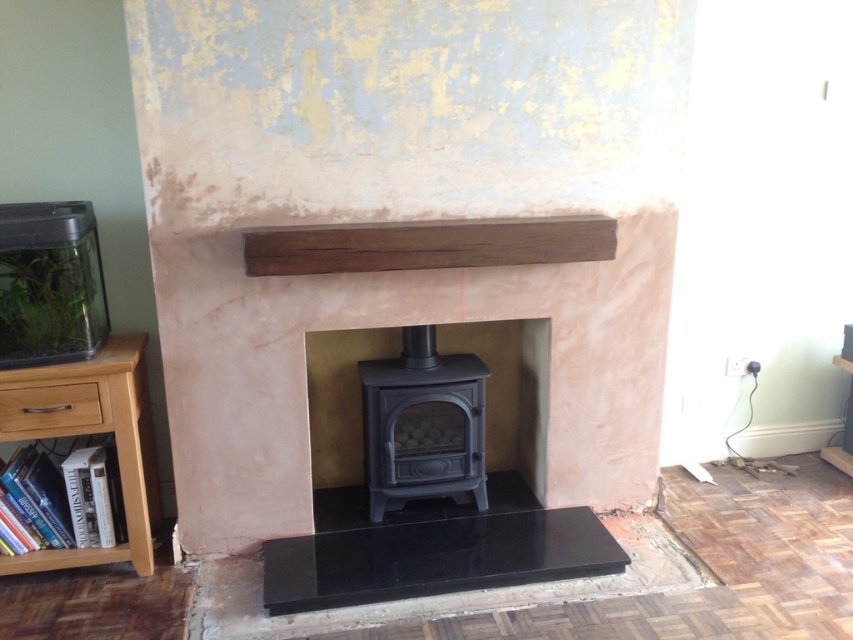
Measure the distance between matte black stove at center and light wood/bookshelf at lower left.

matte black stove at center is 35.94 inches from light wood/bookshelf at lower left.

Does point (491, 348) lie behind point (151, 561)?

Yes, point (491, 348) is behind point (151, 561).

Find the location of `matte black stove at center`. matte black stove at center is located at coordinates (509, 388).